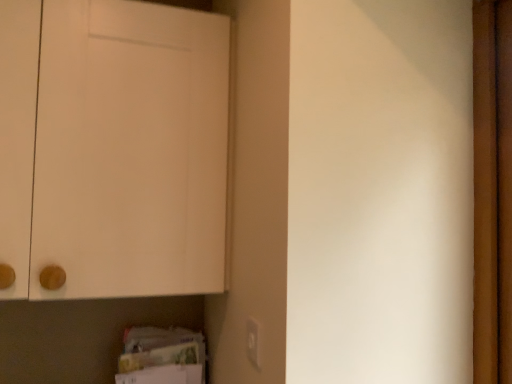
What do you see at coordinates (253, 342) in the screenshot?
I see `matte white electric outlet at lower center` at bounding box center [253, 342].

Identify the location of matte white electric outlet at lower center. (253, 342).

What do you see at coordinates (113, 148) in the screenshot? I see `white matte cabinet at upper left` at bounding box center [113, 148].

Looking at this image, measure the distance between white matte cabinet at upper left and camera.

The depth of white matte cabinet at upper left is 36.59 inches.

At what (x,y) coordinates should I click in order to perform the action: click on white matte cabinet at upper left. Please return your answer as a coordinate pair (x, y). The image size is (512, 384). Looking at the image, I should click on (113, 148).

I want to click on matte white electric outlet at lower center, so click(x=253, y=342).

Which is more to the left, matte white electric outlet at lower center or white matte cabinet at upper left?

white matte cabinet at upper left.

Is matte white electric outlet at lower center closer to the viewer compared to white matte cabinet at upper left?

Yes, matte white electric outlet at lower center is in front of white matte cabinet at upper left.

Which is closer, (247, 341) or (124, 137)?

The point (247, 341) is closer to the camera.

From the image's perspective, is matte white electric outlet at lower center above or below white matte cabinet at upper left?

matte white electric outlet at lower center is situated lower than white matte cabinet at upper left in the image.

From a real-world perspective, is matte white electric outlet at lower center physically above white matte cabinet at upper left?

Incorrect, from a real-world perspective, matte white electric outlet at lower center is lower than white matte cabinet at upper left.

Between matte white electric outlet at lower center and white matte cabinet at upper left, which one has smaller width?

Thinner between the two is matte white electric outlet at lower center.

Can you confirm if matte white electric outlet at lower center is taller than white matte cabinet at upper left?

Incorrect, the height of matte white electric outlet at lower center is not larger of that of white matte cabinet at upper left.

Is matte white electric outlet at lower center smaller than white matte cabinet at upper left?

Yes.

Is white matte cabinet at upper left surrounded by matte white electric outlet at lower center?

Definitely not — white matte cabinet at upper left is not inside matte white electric outlet at lower center.

Are matte white electric outlet at lower center and white matte cabinet at upper left beside each other?

No, matte white electric outlet at lower center is not making contact with white matte cabinet at upper left.

Is white matte cabinet at upper left at the back of matte white electric outlet at lower center?

No, white matte cabinet at upper left is not at the back of matte white electric outlet at lower center.

How many degrees apart are the facing directions of matte white electric outlet at lower center and white matte cabinet at upper left?

92 degrees.

Where is `door on the left of matte white electric outlet at lower center`? door on the left of matte white electric outlet at lower center is located at coordinates (113, 148).

Considering the relative positions of white matte cabinet at upper left and matte white electric outlet at lower center in the image provided, is white matte cabinet at upper left to the right of matte white electric outlet at lower center from the viewer's perspective?

No, white matte cabinet at upper left is not to the right of matte white electric outlet at lower center.

Which object is closer to the camera, white matte cabinet at upper left or matte white electric outlet at lower center?

matte white electric outlet at lower center.

Is point (216, 25) in front of point (253, 347)?

That is False.

From the image's perspective, which is below, white matte cabinet at upper left or matte white electric outlet at lower center?

matte white electric outlet at lower center, from the image's perspective.

From a real-world perspective, is white matte cabinet at upper left physically above matte white electric outlet at lower center?

Yes, from a real-world perspective, white matte cabinet at upper left is above matte white electric outlet at lower center.

Looking at their sizes, would you say white matte cabinet at upper left is wider or thinner than matte white electric outlet at lower center?

white matte cabinet at upper left is wider than matte white electric outlet at lower center.

Can you confirm if white matte cabinet at upper left is shorter than matte white electric outlet at lower center?

No, white matte cabinet at upper left is not shorter than matte white electric outlet at lower center.

Between white matte cabinet at upper left and matte white electric outlet at lower center, which one has larger size?

Bigger between the two is white matte cabinet at upper left.

Would you say matte white electric outlet at lower center is part of white matte cabinet at upper left's contents?

Definitely not — matte white electric outlet at lower center is not inside white matte cabinet at upper left.

Is white matte cabinet at upper left next to matte white electric outlet at lower center?

No, white matte cabinet at upper left is not in contact with matte white electric outlet at lower center.

Could you tell me if white matte cabinet at upper left is turned towards matte white electric outlet at lower center?

Yes, white matte cabinet at upper left is turned towards matte white electric outlet at lower center.

This screenshot has width=512, height=384. I want to click on electric outlet lying in front of the white matte cabinet at upper left, so click(253, 342).

The image size is (512, 384). I want to click on electric outlet that is under the white matte cabinet at upper left (from a real-world perspective), so click(x=253, y=342).

At what (x,y) coordinates should I click in order to perform the action: click on door that is on the left side of matte white electric outlet at lower center. Please return your answer as a coordinate pair (x, y). The height and width of the screenshot is (384, 512). Looking at the image, I should click on (113, 148).